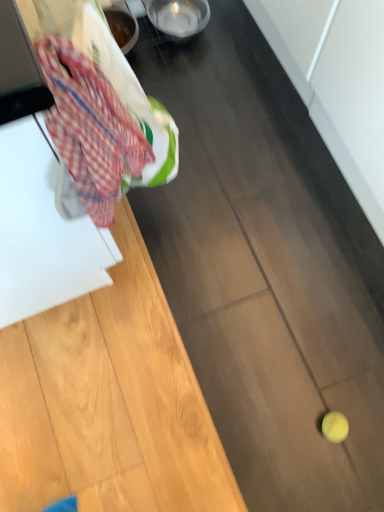
The width and height of the screenshot is (384, 512). What do you see at coordinates (110, 78) in the screenshot?
I see `white fabric grocery bag at upper left` at bounding box center [110, 78].

The height and width of the screenshot is (512, 384). In order to click on white fabric grocery bag at upper left in this screenshot , I will do `click(110, 78)`.

The height and width of the screenshot is (512, 384). I want to click on white fabric grocery bag at upper left, so [110, 78].